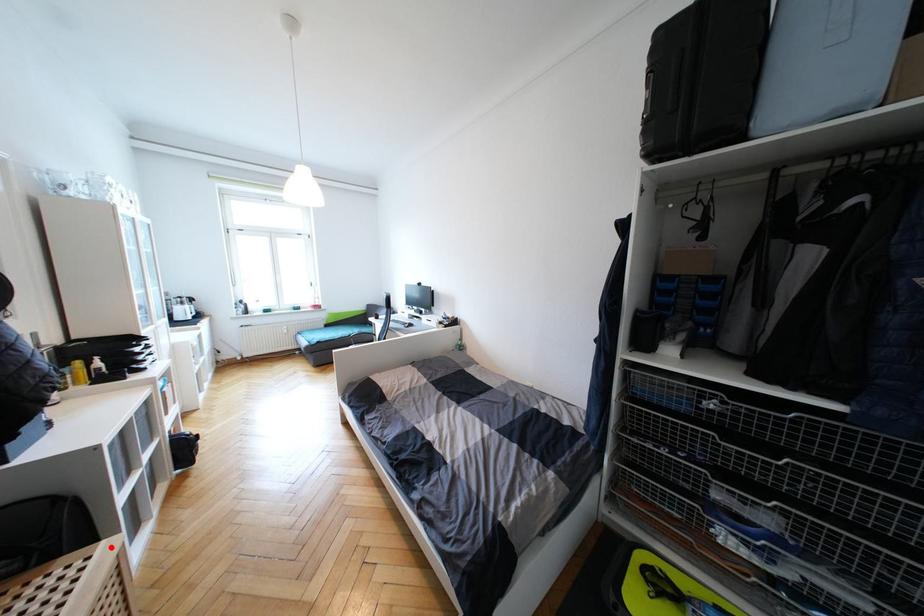
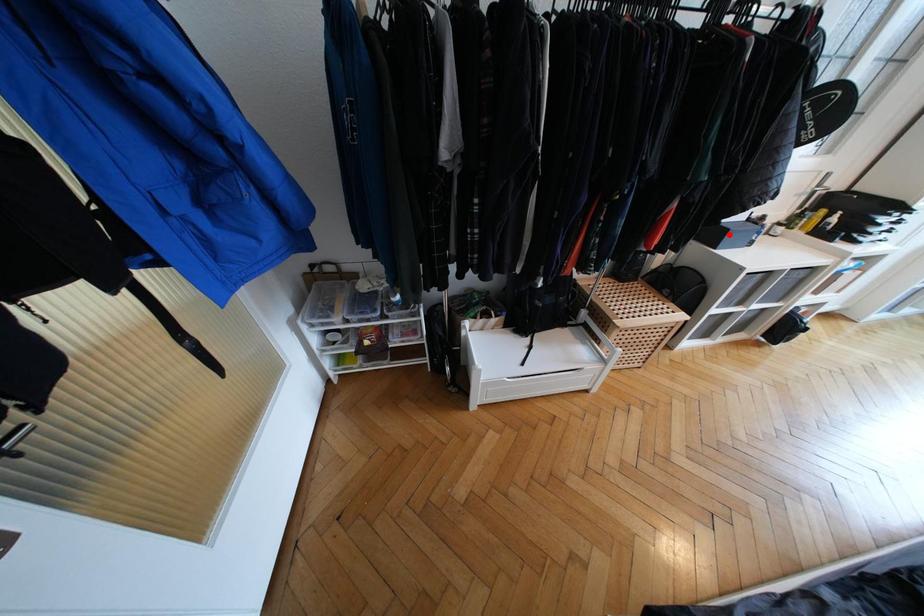
I am providing you with two images of the same scene from different viewpoints. A red point is marked on the first image and another point is marked on the second image. Is the marked point in image1 the same physical position as the marked point in image2?

No